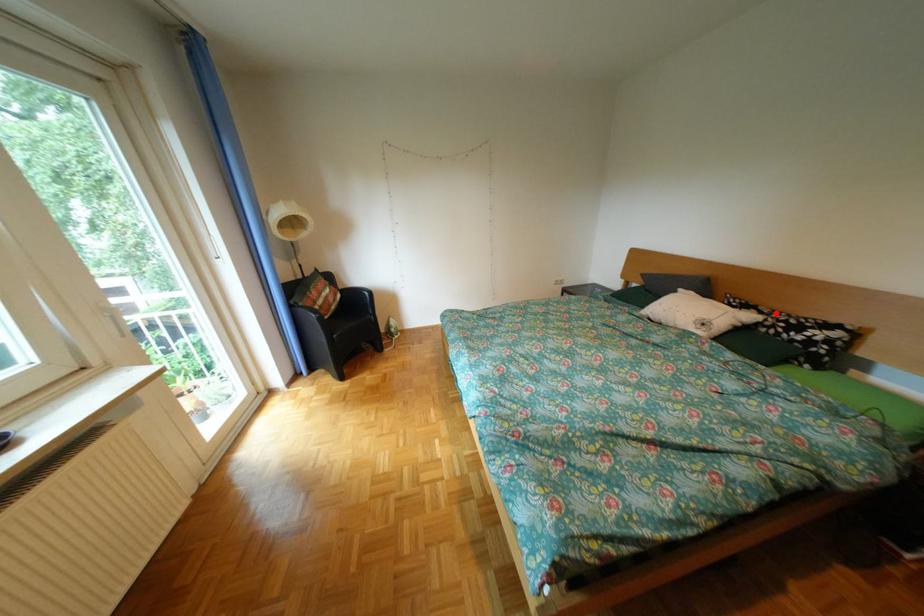
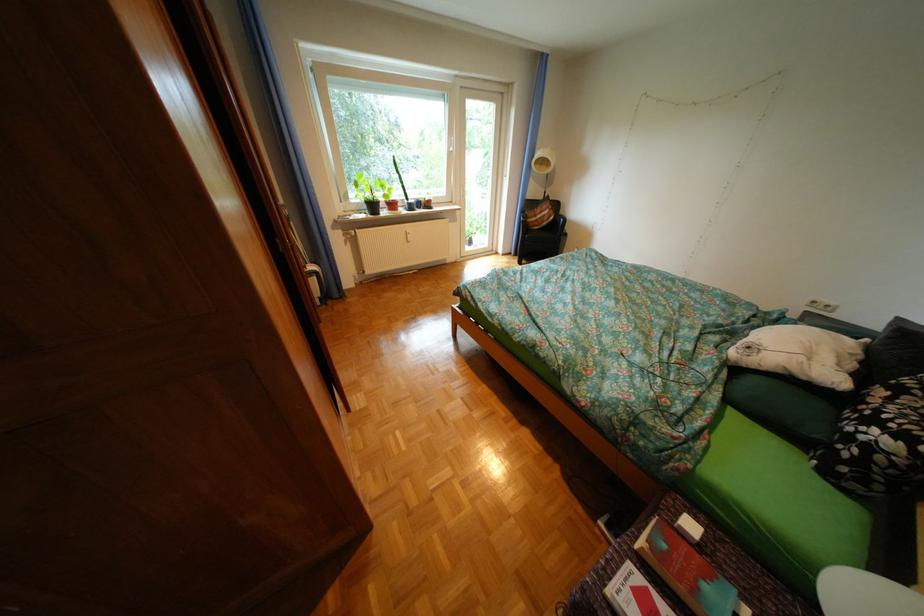
Where in the second image is the point corresponding to the highlighted location from the first image?

(904, 399)